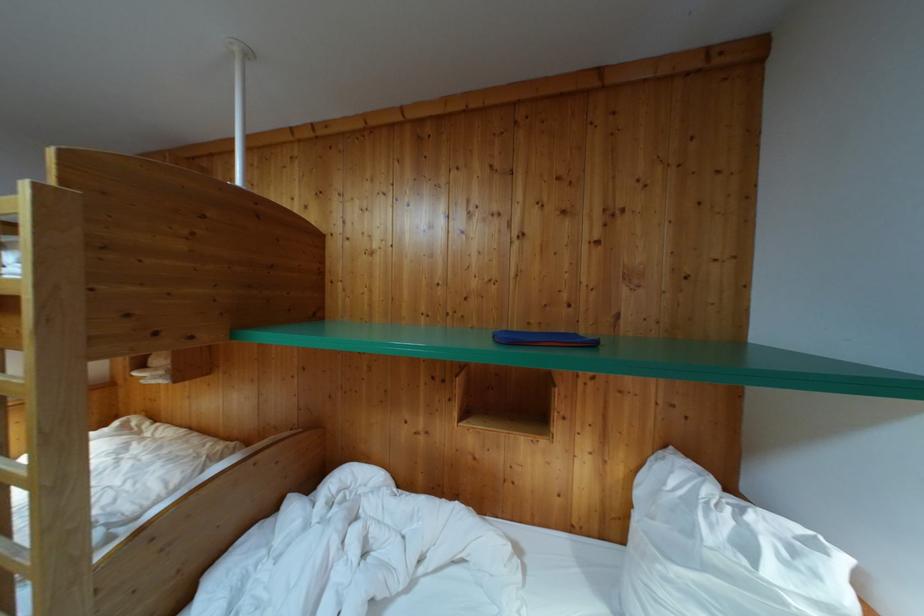
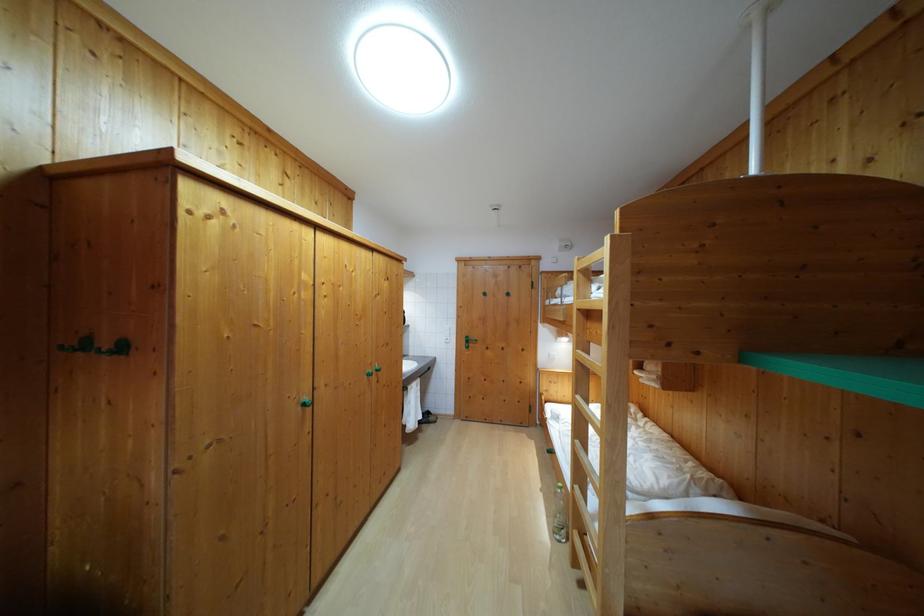
Question: The camera is either moving clockwise (left) or counter-clockwise (right) around the object. The first image is from the beginning of the video and the second image is from the end. Is the camera moving left or right when shooting the video?

Choices:
 (A) Left
 (B) Right

Answer: (B)